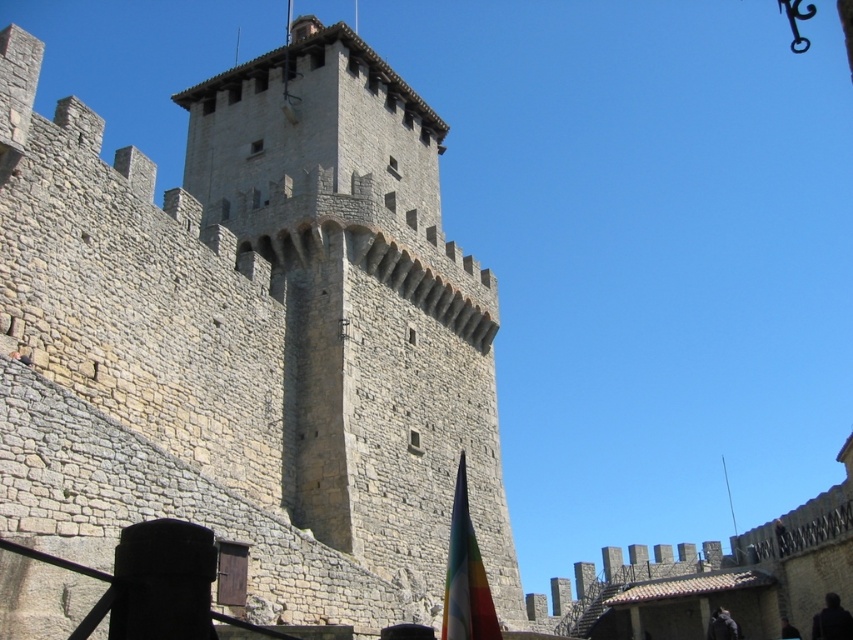
Question: Is stone tower at center bigger than multicolored fabric flag at lower center?

Choices:
 (A) no
 (B) yes

Answer: (B)

Question: Does stone tower at center appear over multicolored fabric flag at lower center?

Choices:
 (A) yes
 (B) no

Answer: (A)

Question: Among these objects, which one is farthest from the camera?

Choices:
 (A) multicolored fabric flag at lower center
 (B) stone tower at center

Answer: (A)

Question: Does stone tower at center have a smaller size compared to multicolored fabric flag at lower center?

Choices:
 (A) yes
 (B) no

Answer: (B)